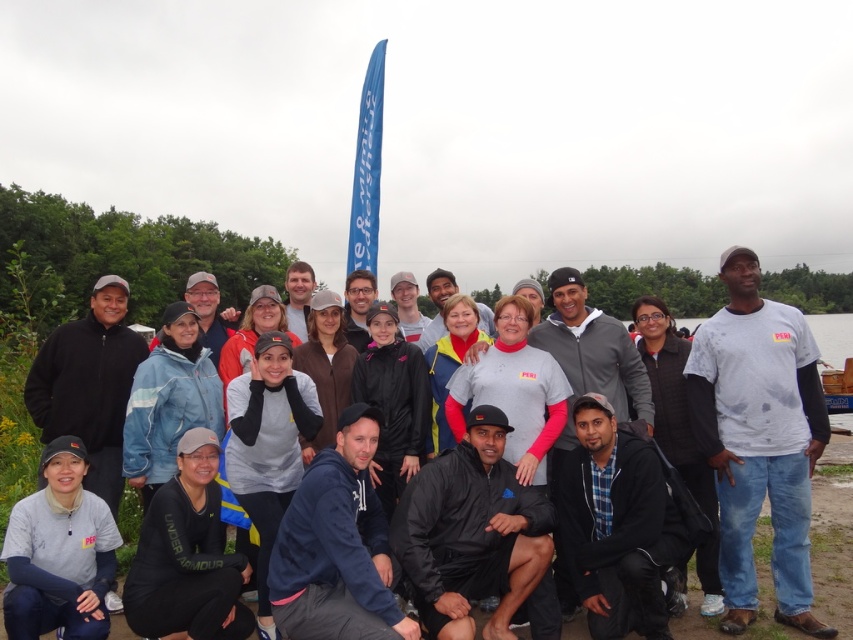
Question: Among these objects, which one is farthest from the camera?

Choices:
 (A) gray fleece jacket at center
 (B) black matte jacket at upper left
 (C) light blue jacket at center

Answer: (C)

Question: In this image, where is white cotton shirt at center located relative to plaid fabric shirt at lower center?

Choices:
 (A) below
 (B) above

Answer: (B)

Question: Which point is farther to the camera?

Choices:
 (A) navy blue fleece at center
 (B) light blue jacket at center
 (C) white cotton shirt at center

Answer: (B)

Question: Does white cotton shirt at center have a greater width compared to gray fleece jacket at center?

Choices:
 (A) yes
 (B) no

Answer: (B)

Question: Which point is closer to the camera?

Choices:
 (A) (94, 337)
 (B) (204, 292)

Answer: (A)

Question: Is black matte jacket at center above plaid fabric shirt at lower center?

Choices:
 (A) no
 (B) yes

Answer: (A)